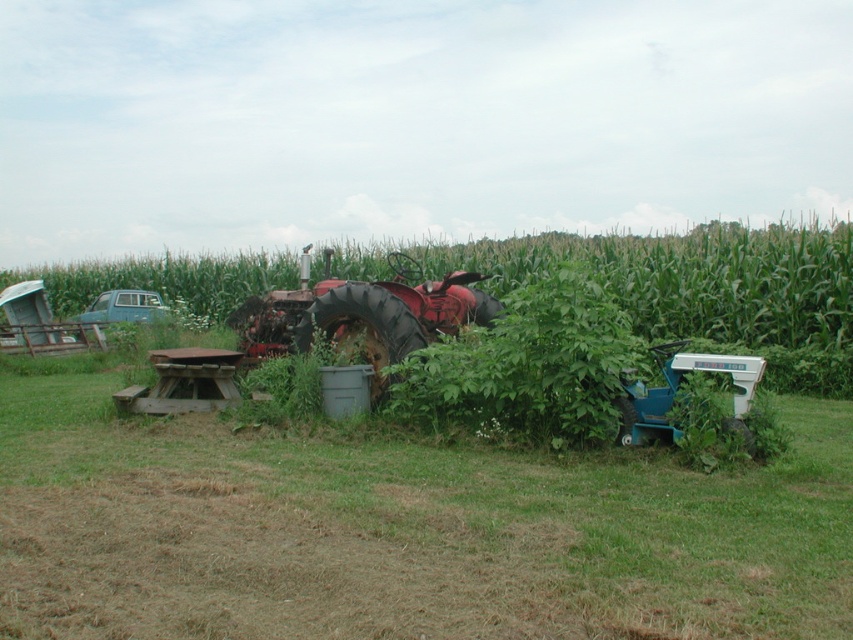
You are standing in the middle of the field and see the green grass at center and the green leafy corn at center. Which one is closer to the ground?

The green grass at center is located below the green leafy corn at center, so it is closer to the ground.

You are a farmer checking the field. You see the rusty metal tractor at center and the teal plastic tractor at lower right. Which tractor is closer to you?

The rusty metal tractor at center is positioned over the teal plastic tractor at lower right, so the rusty metal tractor at center is closer to you.

You are a farmer trying to locate your rusty metal tractor at center in the field. According to the coordinates provided, where exactly is the tractor positioned?

The rusty metal tractor at center is located at point (363, 314), so it is exactly at that coordinate position.